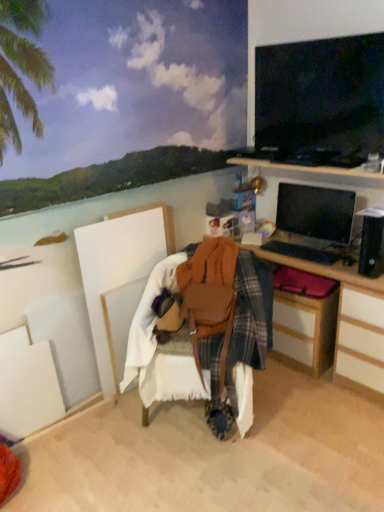
Question: From a real-world perspective, is wooden desk at center above or below matte black monitor at right?

Choices:
 (A) below
 (B) above

Answer: (A)

Question: Would you say wooden desk at center is to the left or to the right of matte black monitor at right in the picture?

Choices:
 (A) right
 (B) left

Answer: (B)

Question: Which object is the farthest from the black glossy tv at upper right?

Choices:
 (A) leather at center
 (B) plaid fabric drawer at right
 (C) wooden desk at center
 (D) matte black monitor at right

Answer: (A)

Question: Which object is positioned farthest from the plaid fabric drawer at right?

Choices:
 (A) leather at center
 (B) matte black monitor at right
 (C) wooden desk at center
 (D) black glossy tv at upper right

Answer: (D)